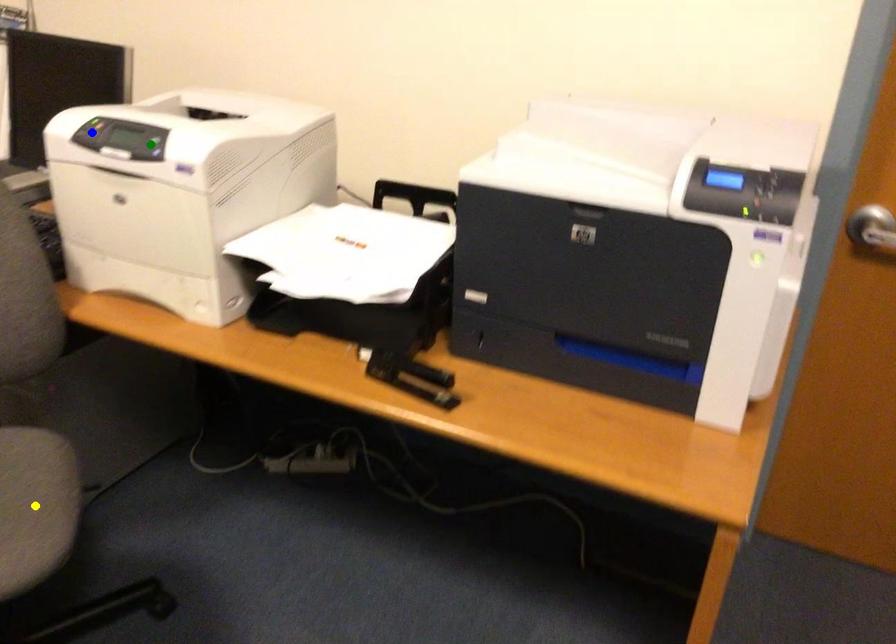
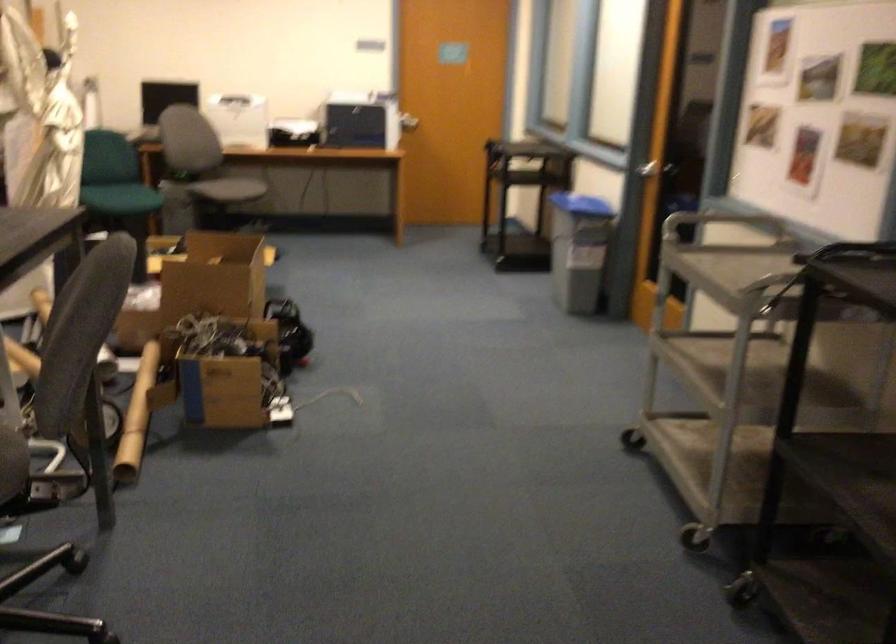
I am providing you with two images of the same scene from different viewpoints. Three points are marked in image1. Which point corresponds to a part or object that is occluded in image2?In image1, three points are marked. Which of them correspond to a part or object that is occluded in image2?Among the three points shown in image1, which one corresponds to a part or object that is no longer visible due to occlusion in image2?

Invisible in image2: green point, blue point, yellow point.